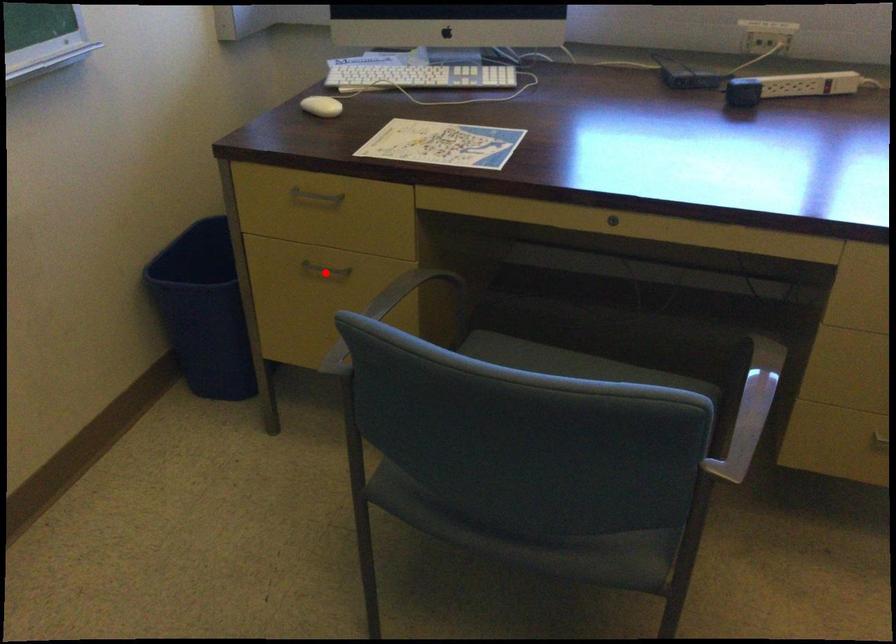
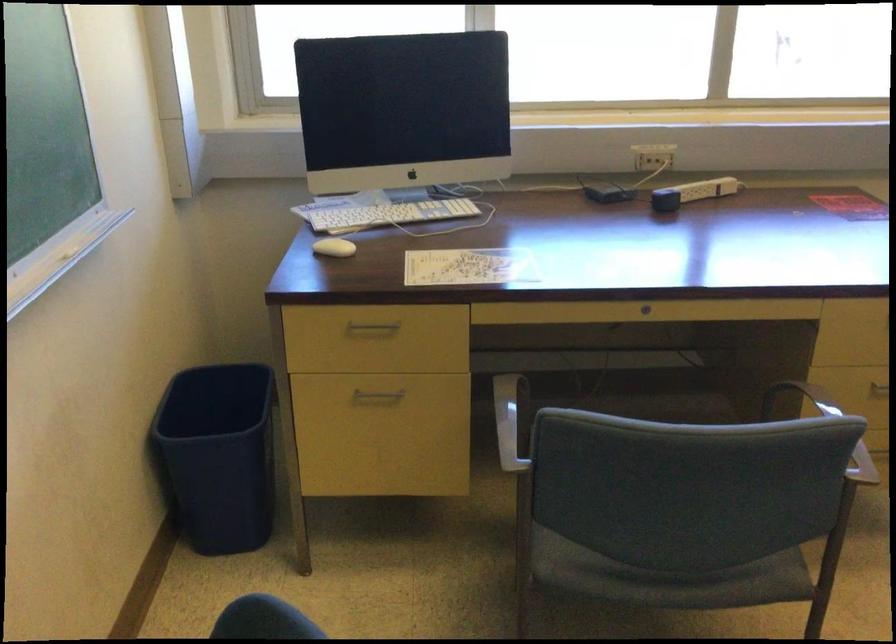
Where in the second image is the point corresponding to the highlighted location from the first image?

(376, 395)